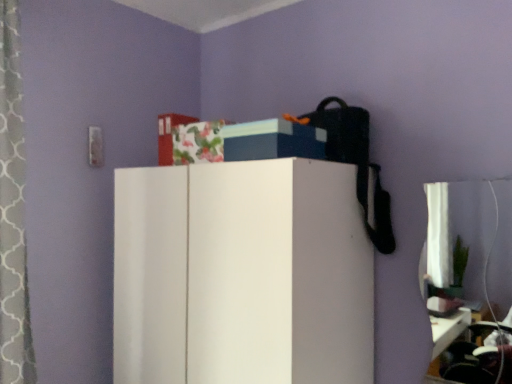
Question: Is white matte cabinet at center inside or outside of blue matte storage box at upper center?

Choices:
 (A) outside
 (B) inside

Answer: (A)

Question: Considering the positions of white matte cabinet at center and blue matte storage box at upper center in the image, is white matte cabinet at center wider or thinner than blue matte storage box at upper center?

Choices:
 (A) wide
 (B) thin

Answer: (A)

Question: Is white matte cabinet at center taller or shorter than blue matte storage box at upper center?

Choices:
 (A) short
 (B) tall

Answer: (B)

Question: Visually, is blue matte storage box at upper center positioned to the left or to the right of white matte cabinet at center?

Choices:
 (A) right
 (B) left

Answer: (A)

Question: In terms of width, does blue matte storage box at upper center look wider or thinner when compared to white matte cabinet at center?

Choices:
 (A) thin
 (B) wide

Answer: (A)

Question: In the image, is blue matte storage box at upper center positioned in front of or behind white matte cabinet at center?

Choices:
 (A) front
 (B) behind

Answer: (B)

Question: Is blue matte storage box at upper center bigger or smaller than white matte cabinet at center?

Choices:
 (A) small
 (B) big

Answer: (A)